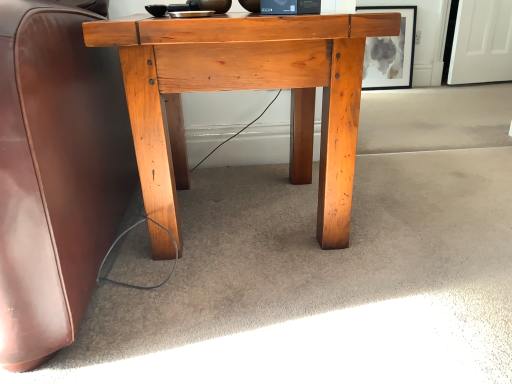
Locate an element on the screen. The width and height of the screenshot is (512, 384). free location to the right of natural wood desk at center is located at coordinates (423, 210).